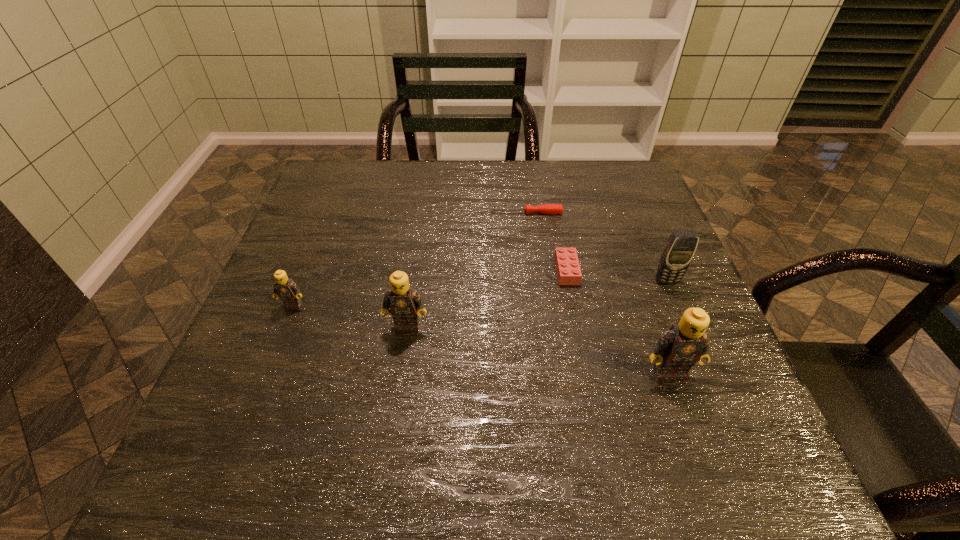
The image size is (960, 540). I want to click on empty location between the third nearest Lego and the shortest Lego, so click(430, 288).

Identify which object is the second nearest to the third Lego from left to right. Please provide its 2D coordinates. Your answer should be formatted as a tuple, i.e. [(x, y)], where the tuple contains the x and y coordinates of a point satisfying the conditions above.

[(681, 246)]

Identify which object is located as the fifth nearest to the screwdriver. Please provide its 2D coordinates. Your answer should be formatted as a tuple, i.e. [(x, y)], where the tuple contains the x and y coordinates of a point satisfying the conditions above.

[(286, 289)]

Identify which Lego is the second closest to the third nearest object. Please provide its 2D coordinates. Your answer should be formatted as a tuple, i.e. [(x, y)], where the tuple contains the x and y coordinates of a point satisfying the conditions above.

[(568, 269)]

This screenshot has height=540, width=960. I want to click on the second closest Lego to the third farthest Lego, so click(568, 269).

The width and height of the screenshot is (960, 540). Find the location of `vacant space that satisfies the following two spatial constraints: 1. at the tip of the screwdriver; 2. in front of the second Lego from left to right`. vacant space that satisfies the following two spatial constraints: 1. at the tip of the screwdriver; 2. in front of the second Lego from left to right is located at coordinates (540, 326).